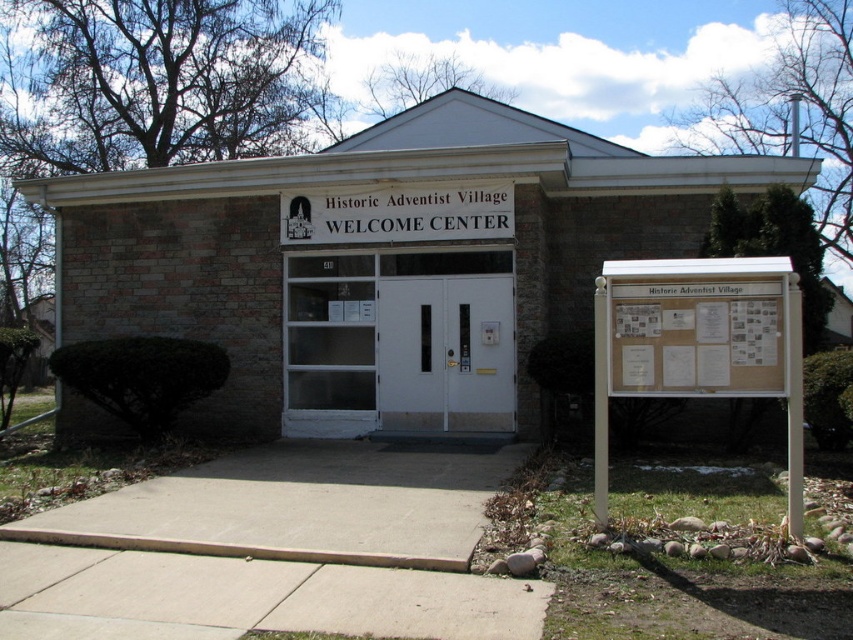
You are standing in front of the Historic Adventist Village WELCOME CENTER and want to read both the white wood signboard at right and the white wood sign at center. Which sign should you look towards first if you want to read them in the order they are placed from left to right?

The white wood sign at center is on the left side of the white wood signboard at right, so you should look towards the white wood sign at center first to read them from left to right.

You are standing in front of the Historic Adventist Village WELCOME CENTER. There is a point marked at coordinates (699, 344). What object is located at this point?

The point at coordinates (699, 344) corresponds to the white wood signboard at right.

You are standing in front of the Historic Adventist Village WELCOME CENTER. You notice two signs, the white wood signboard at right and the white wood sign at center. Which one is closer to you?

The white wood signboard at right is closer to the viewer than the white wood sign at center.